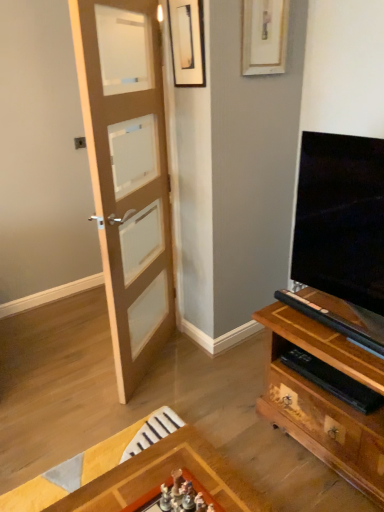
Find the location of a particular element. free location in front of light brown wooden door at left is located at coordinates (146, 412).